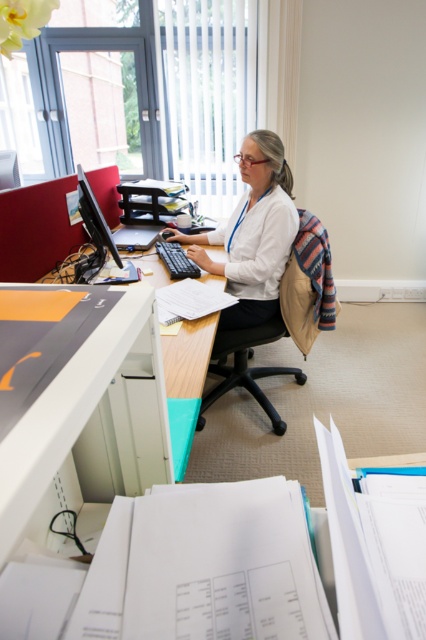
Is white matte shirt at center smaller than black fabric swivel chair at center?

Incorrect, white matte shirt at center is not smaller in size than black fabric swivel chair at center.

Does white matte shirt at center appear on the left side of black fabric swivel chair at center?

Yes, white matte shirt at center is to the left of black fabric swivel chair at center.

Locate an element on the screen. The width and height of the screenshot is (426, 640). white matte shirt at center is located at coordinates (253, 234).

You are a GUI agent. You are given a task and a screenshot of the screen. Output one action in this format:
    pyautogui.click(x=<x>, y=<y>)
    Task: Click on the white matte shirt at center
    The height and width of the screenshot is (640, 426).
    Given the screenshot: What is the action you would take?
    pyautogui.click(x=253, y=234)

Can you confirm if white matte shirt at center is thinner than wooden desk at center?

Incorrect, white matte shirt at center's width is not less than wooden desk at center's.

Between white matte shirt at center and wooden desk at center, which one appears on the right side from the viewer's perspective?

white matte shirt at center

Does point (279, 244) come closer to viewer compared to point (181, 468)?

No, it is not.

Locate an element on the screen. This screenshot has width=426, height=640. white matte shirt at center is located at coordinates (253, 234).

Can you confirm if wooden desk at center is positioned above matte black monitor at left?

No.

Is wooden desk at center smaller than matte black monitor at left?

Actually, wooden desk at center might be larger than matte black monitor at left.

Between point (172, 371) and point (103, 253), which one is positioned behind?

Positioned behind is point (103, 253).

Locate an element on the screen. wooden desk at center is located at coordinates click(187, 380).